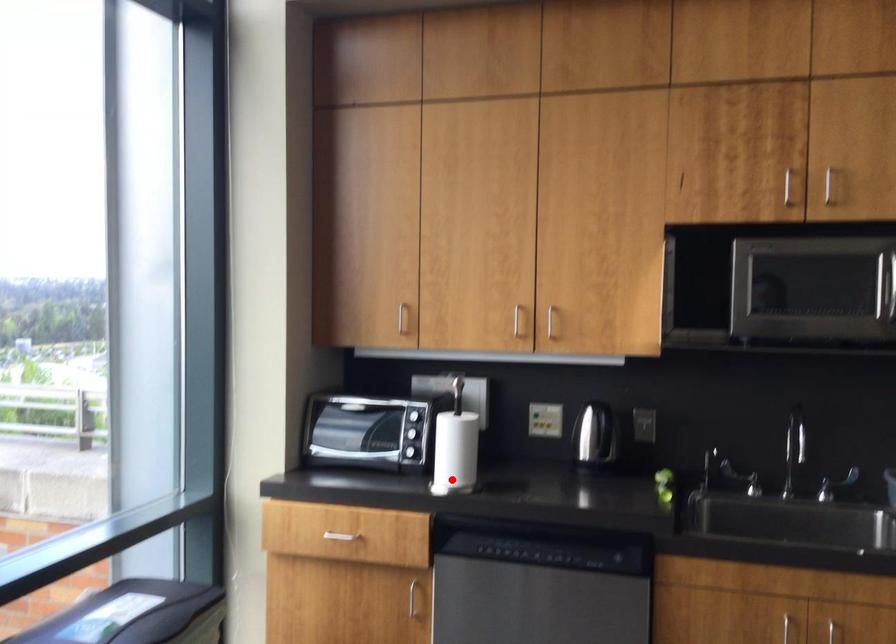
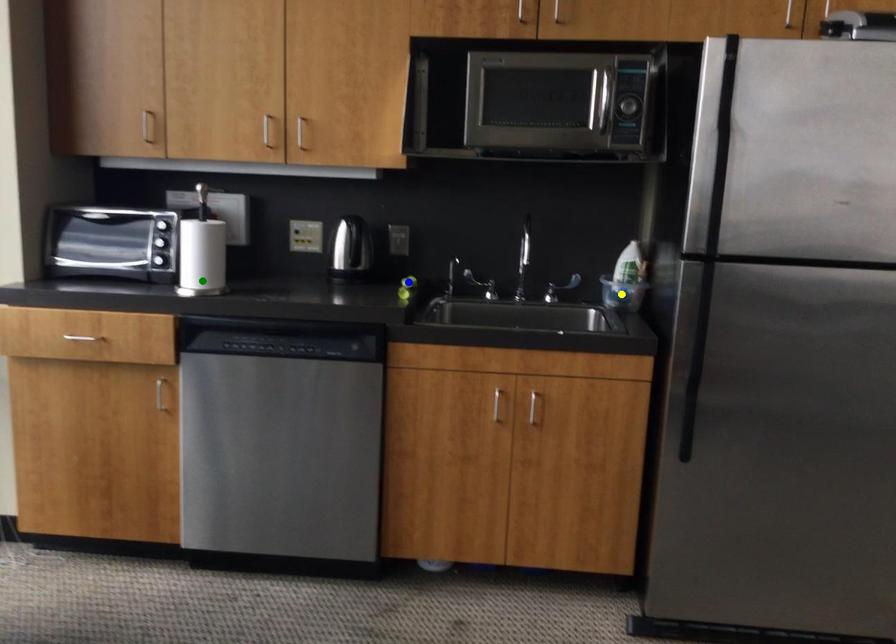
Question: I am providing you with two images of the same scene from different viewpoints. A red point is marked on the first image. You are given multiple points on the second image. Which point in image 2 is actually the same real-world point as the red point in image 1?

Choices:
 (A) yellow point
 (B) blue point
 (C) green point

Answer: (C)